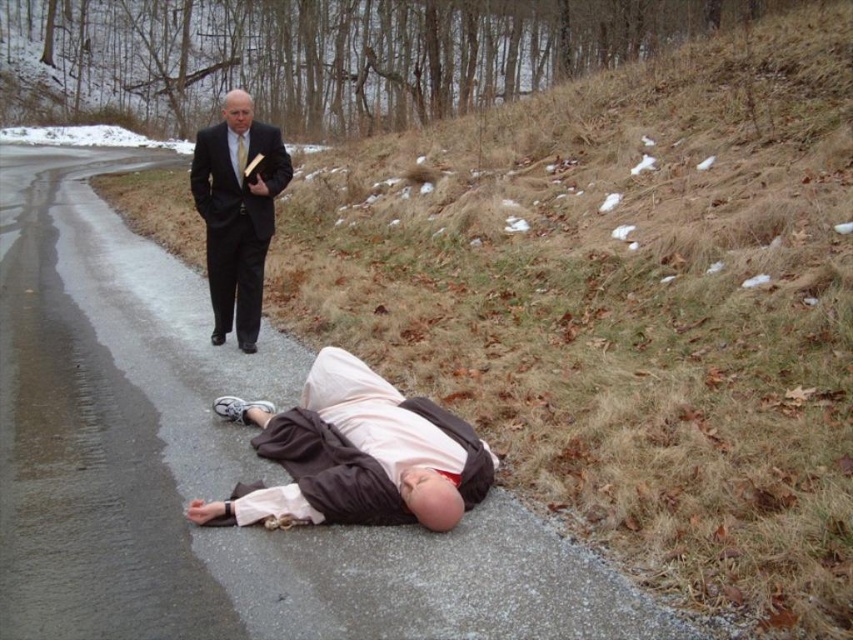
You are a pedestrian crossing the road and see the brown fabric shirt at lower center and the matte black suit at upper left. Which one is closer to you?

The brown fabric shirt at lower center is closer to the viewer than the matte black suit at upper left.

You are a pedestrian crossing the road and see the brown fabric shirt at lower center and the matte black suit at upper left. Which one is closer to your right side?

The brown fabric shirt at lower center is to the right of matte black suit at upper left, so the brown fabric shirt at lower center is closer to your right side.